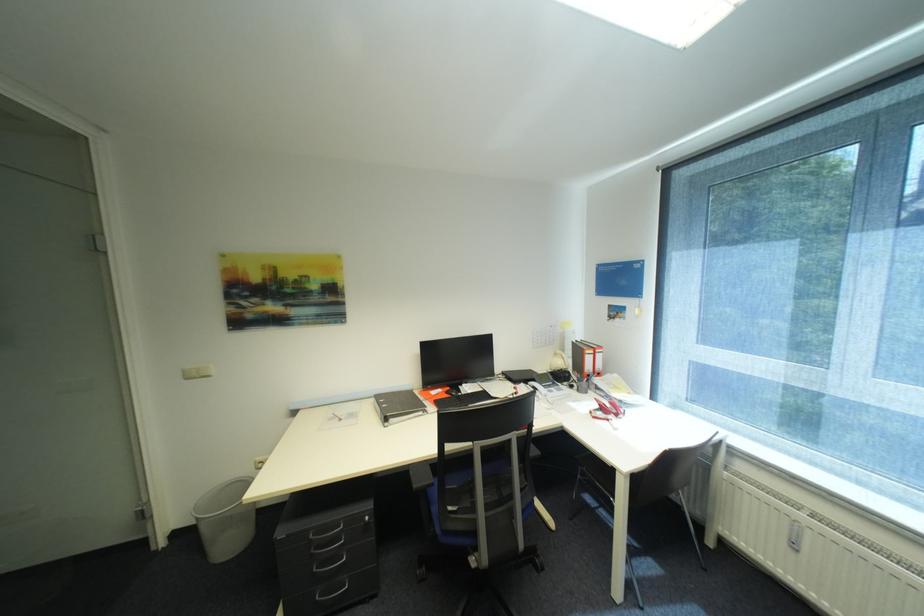
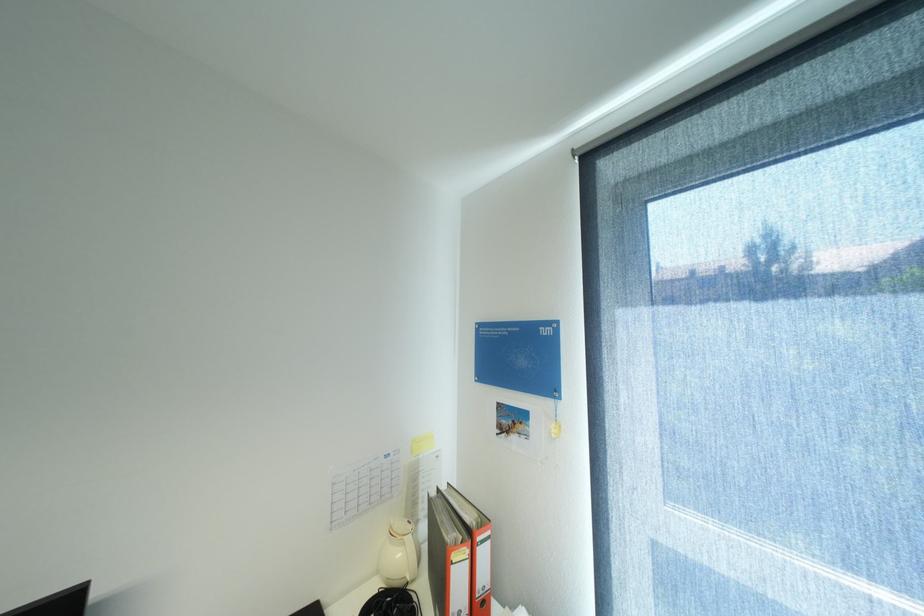
What movement of the cameraman would produce the second image?

The cameraman moved toward right, forward.